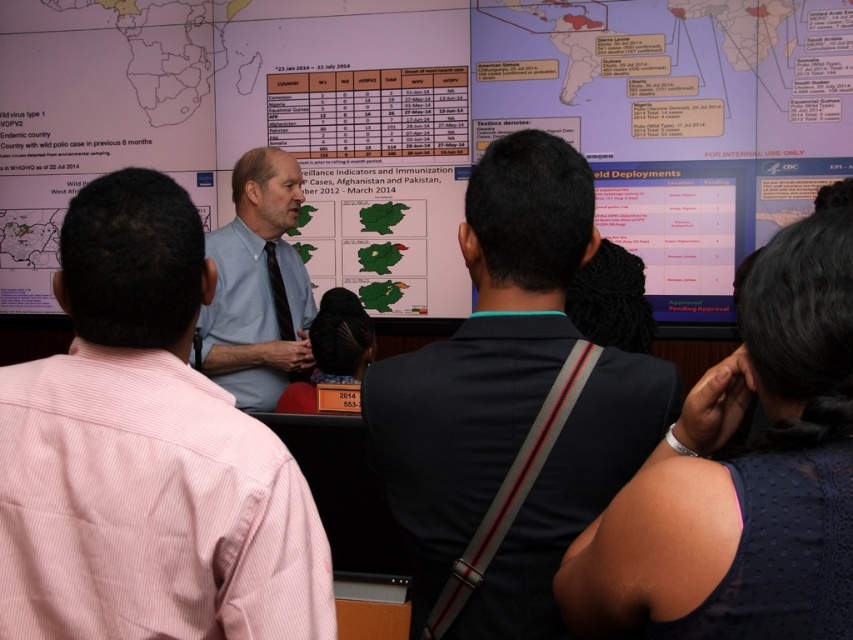
Does light blue shirt at center appear over blue shirt at center?

Incorrect, light blue shirt at center is not positioned above blue shirt at center.

Does light blue shirt at center appear on the right side of blue shirt at center?

Correct, you'll find light blue shirt at center to the right of blue shirt at center.

Locate an element on the screen. The height and width of the screenshot is (640, 853). light blue shirt at center is located at coordinates (146, 454).

I want to click on light blue shirt at center, so click(146, 454).

Locate an element on the screen. Image resolution: width=853 pixels, height=640 pixels. matte paper map at upper center is located at coordinates (430, 122).

Can you confirm if matte paper map at upper center is shorter than dark blue textured dress at center?

No.

Is point (390, 200) more distant than point (828, 328)?

Yes, point (390, 200) is farther from viewer.

The height and width of the screenshot is (640, 853). I want to click on matte paper map at upper center, so click(x=430, y=122).

Is point (532, 26) more distant than point (155, 378)?

Yes, point (532, 26) is behind point (155, 378).

Can you confirm if matte paper map at upper center is positioned to the left of light blue shirt at center?

In fact, matte paper map at upper center is to the right of light blue shirt at center.

In order to click on matte paper map at upper center in this screenshot , I will do `click(430, 122)`.